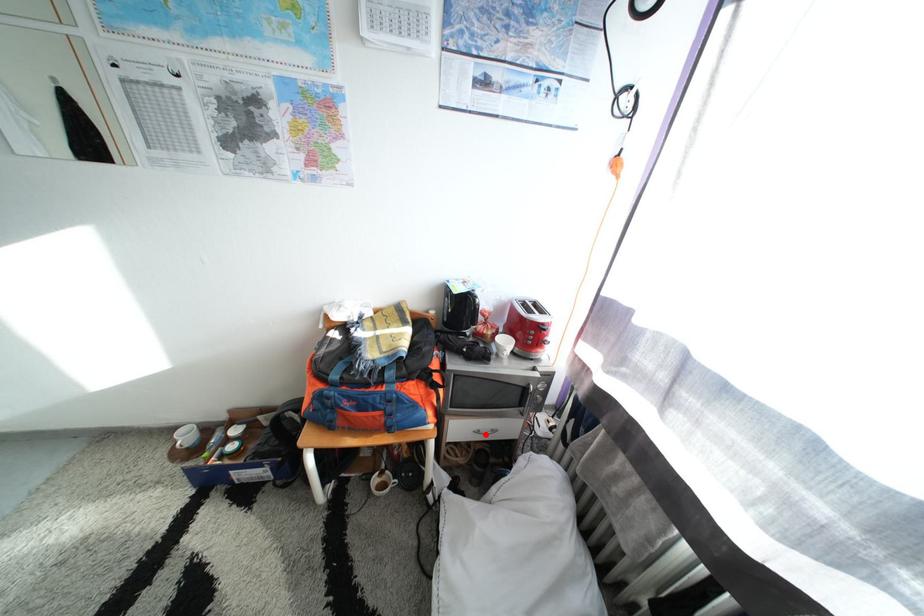
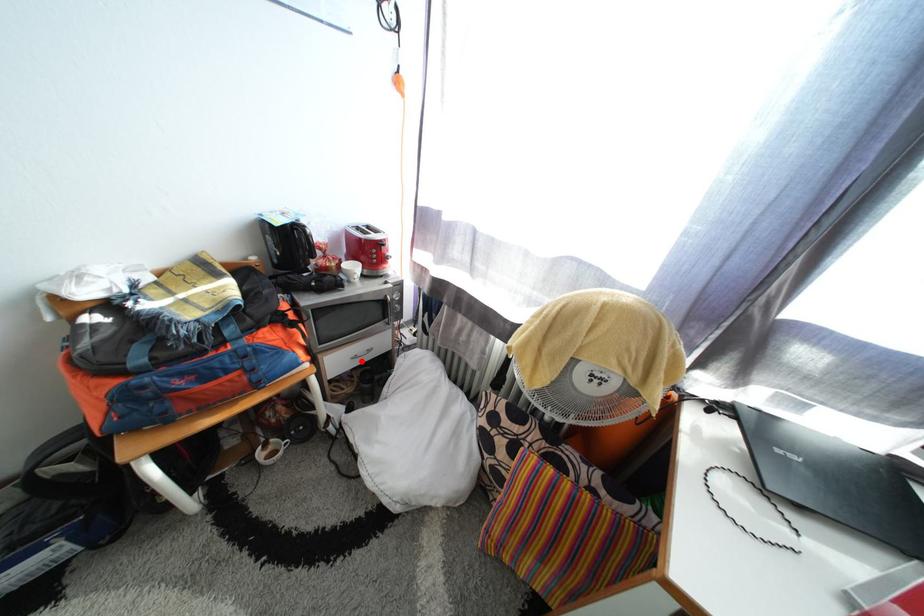
I am providing you with two images of the same scene from different viewpoints. A red point is marked on the first image and another point is marked on the second image. Do the highlighted points in image1 and image2 indicate the same real-world spot?

Yes